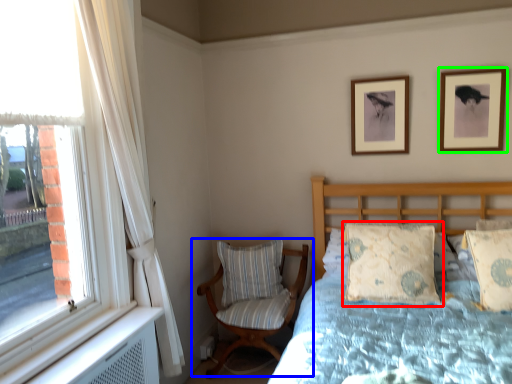
Question: Based on their relative distances, which object is farther from pillow (highlighted by a red box)? Choose from chair (highlighted by a blue box) and picture frame (highlighted by a green box).

Choices:
 (A) chair
 (B) picture frame

Answer: (B)